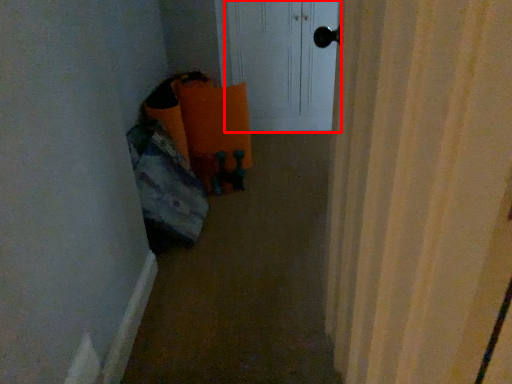
Question: Observing the image, what is the correct spatial positioning of screen door (annotated by the red box) in reference to corridor?

Choices:
 (A) right
 (B) left

Answer: (A)